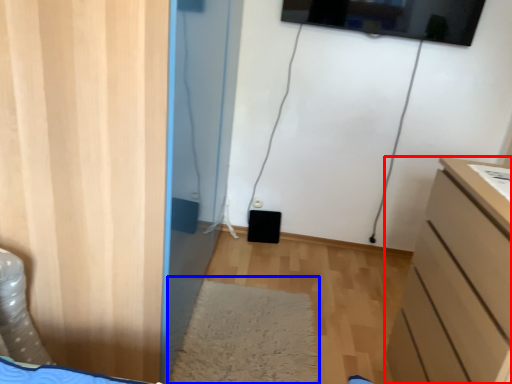
Question: Which of the following is the farthest to the observer, chest of drawers (highlighted by a red box) or mat (highlighted by a blue box)?

Choices:
 (A) chest of drawers
 (B) mat

Answer: (B)